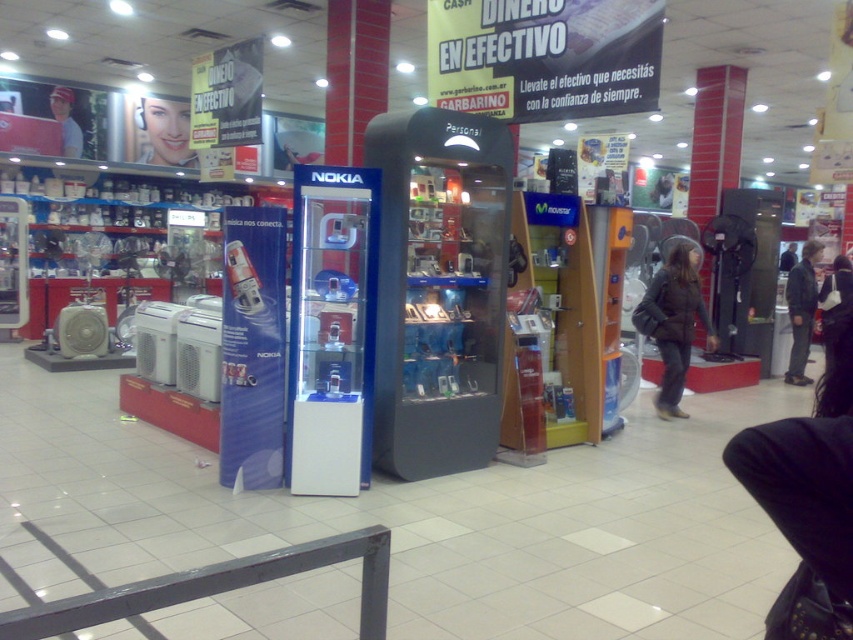
You are a customer in the electronics store and want to pick up the dark gray jacket at center. However, you notice there are display cases and a standee nearby. Based on their positions, can you reach the jacket without moving any obstacles?

The dark gray jacket at center is located at point coordinates, but without knowing the positions of the display cases and standee, it is impossible to determine if there are obstacles blocking the path. Please check the layout again.